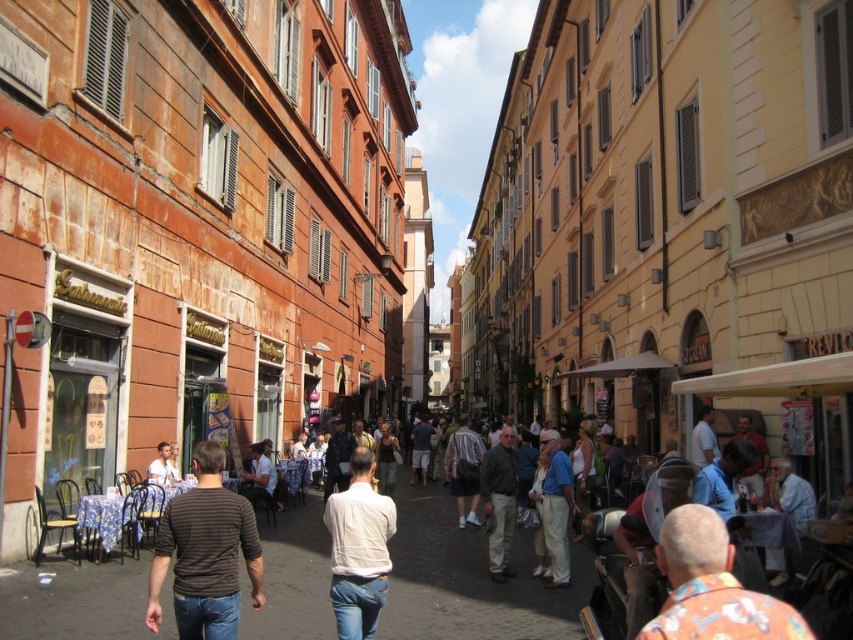
Question: From the image, what is the correct spatial relationship of striped cotton shirt at center in relation to floral shirt at lower right?

Choices:
 (A) above
 (B) below

Answer: (B)

Question: Which of the following is the closest to the observer?

Choices:
 (A) white matte shirt at center
 (B) striped cotton shirt at center
 (C) white cotton shirt at center

Answer: (B)

Question: Which of the following is the farthest from the observer?

Choices:
 (A) (492, 490)
 (B) (546, 576)
 (C) (693, 512)
 (D) (358, 547)

Answer: (A)

Question: Can you confirm if floral shirt at lower right is positioned above white cotton shirt at center?

Choices:
 (A) yes
 (B) no

Answer: (A)

Question: Which of the following is the farthest from the observer?

Choices:
 (A) white cotton shirt at center
 (B) floral shirt at lower right
 (C) white matte shirt at center

Answer: (A)

Question: Can you confirm if striped cotton shirt at center is positioned above dark gray sweater at center?

Choices:
 (A) yes
 (B) no

Answer: (A)